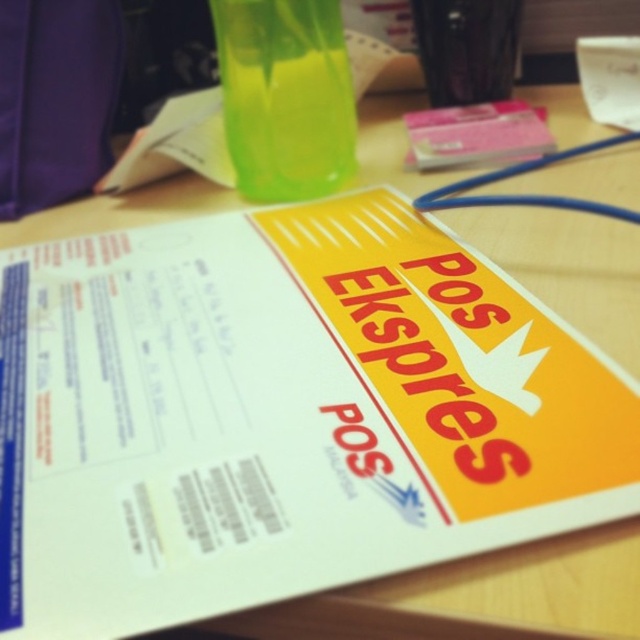
Question: Does purple fabric bag at upper left have a lesser width compared to transparent plastic cup at upper center?

Choices:
 (A) no
 (B) yes

Answer: (B)

Question: From the image, what is the correct spatial relationship of translucent green cup at upper center in relation to purple fabric bag at upper left?

Choices:
 (A) left
 (B) right

Answer: (B)

Question: From the image, what is the correct spatial relationship of purple fabric bag at upper left in relation to transparent plastic cup at upper center?

Choices:
 (A) right
 (B) left

Answer: (B)

Question: Which of the following is the farthest from the observer?

Choices:
 (A) (340, 64)
 (B) (456, 29)
 (C) (1, 80)

Answer: (B)

Question: Which of these objects is positioned closest to the purple fabric bag at upper left?

Choices:
 (A) transparent plastic cup at upper center
 (B) translucent green cup at upper center

Answer: (B)

Question: Which object is closer to the camera taking this photo?

Choices:
 (A) translucent green cup at upper center
 (B) transparent plastic cup at upper center
 (C) purple fabric bag at upper left

Answer: (A)